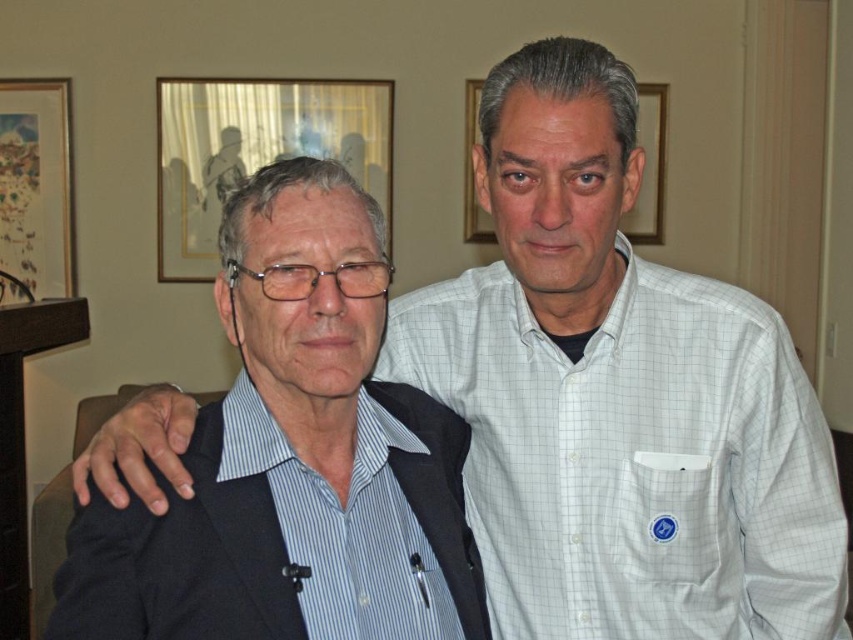
Is point (201, 428) closer to camera compared to point (30, 252)?

Yes, point (201, 428) is closer to viewer.

Does point (451, 604) come farther from viewer compared to point (25, 180)?

No, it is in front of (25, 180).

Is point (440, 563) more distant than point (57, 134)?

No, (440, 563) is closer to viewer.

Find the location of `blue striped shirt at left`. blue striped shirt at left is located at coordinates (293, 464).

Which is in front, point (239, 627) or point (164, 99)?

Point (239, 627)

Does blue striped shirt at left have a lesser width compared to matte glass picture frame at upper center?

Correct, blue striped shirt at left's width is less than matte glass picture frame at upper center's.

Is point (347, 486) in front of point (368, 83)?

Yes, it is.

You are a GUI agent. You are given a task and a screenshot of the screen. Output one action in this format:
    pyautogui.click(x=<x>, y=<y>)
    Task: Click on the blue striped shirt at left
    
    Given the screenshot: What is the action you would take?
    pyautogui.click(x=293, y=464)

Does matte glass picture frame at upper center have a larger size compared to matte wood picture frame at center?

Correct, matte glass picture frame at upper center is larger in size than matte wood picture frame at center.

Is matte glass picture frame at upper center positioned before matte wood picture frame at center?

That is True.

In order to click on matte glass picture frame at upper center in this screenshot , I will do `click(256, 148)`.

Locate an element on the screen. Image resolution: width=853 pixels, height=640 pixels. matte glass picture frame at upper center is located at coordinates (256, 148).